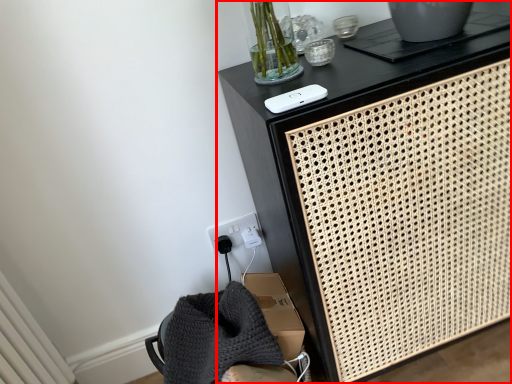
Question: In this image, where is furniture (annotated by the red box) located relative to ipod?

Choices:
 (A) left
 (B) right

Answer: (B)